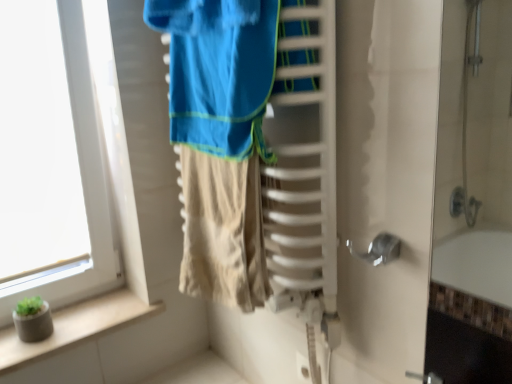
Locate an element on the screen. free point below white glass window at left (from a real-world perspective) is located at coordinates (86, 311).